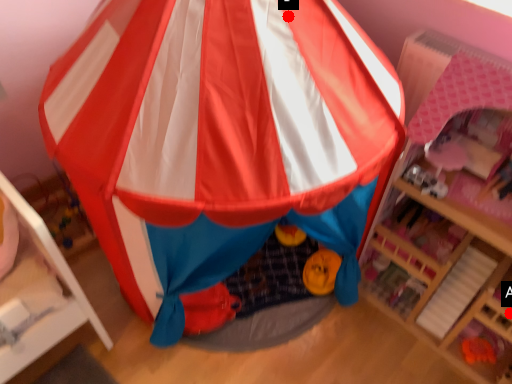
Question: Two points are circled on the image, labeled by A and B beside each circle. Which point is closer to the camera taking this photo?

Choices:
 (A) A is closer
 (B) B is closer

Answer: (B)